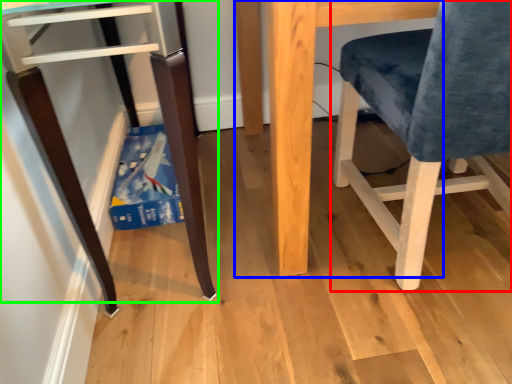
Question: Which object is positioned closest to chair (highlighted by a red box)? Select from table (highlighted by a blue box) and furniture (highlighted by a green box).

Choices:
 (A) table
 (B) furniture

Answer: (A)